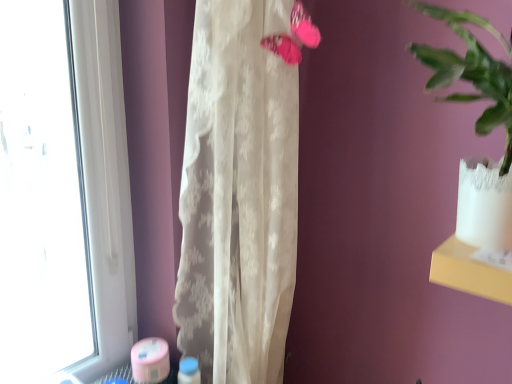
Find the location of a particular element. This screenshot has width=512, height=384. translucent white curtain at center is located at coordinates (238, 194).

Measure the distance between translucent white curtain at center and camera.

translucent white curtain at center and camera are 32.79 inches apart.

What do you see at coordinates (238, 194) in the screenshot?
I see `translucent white curtain at center` at bounding box center [238, 194].

This screenshot has height=384, width=512. Describe the element at coordinates (294, 36) in the screenshot. I see `pink fabric butterfly at upper center` at that location.

The height and width of the screenshot is (384, 512). I want to click on pink fabric butterfly at upper center, so click(x=294, y=36).

In order to click on translucent white curtain at center in this screenshot , I will do `click(238, 194)`.

Considering the relative positions of pink fabric butterfly at upper center and translucent white curtain at center in the image provided, is pink fabric butterfly at upper center to the right of translucent white curtain at center from the viewer's perspective?

Correct, you'll find pink fabric butterfly at upper center to the right of translucent white curtain at center.

Does pink fabric butterfly at upper center lie behind translucent white curtain at center?

Yes, pink fabric butterfly at upper center is further from the camera.

Is point (293, 50) less distant than point (198, 177)?

Yes, point (293, 50) is closer to viewer.

From the image's perspective, relative to translucent white curtain at center, is pink fabric butterfly at upper center above or below?

Based on their image positions, pink fabric butterfly at upper center is located above translucent white curtain at center.

From a real-world perspective, which object stands above the other?

In real-world perspective, pink fabric butterfly at upper center is above.

Which object is thinner, pink fabric butterfly at upper center or translucent white curtain at center?

With smaller width is pink fabric butterfly at upper center.

Considering the relative sizes of pink fabric butterfly at upper center and translucent white curtain at center in the image provided, is pink fabric butterfly at upper center taller than translucent white curtain at center?

No.

Based on the photo, considering the sizes of objects pink fabric butterfly at upper center and translucent white curtain at center in the image provided, who is bigger, pink fabric butterfly at upper center or translucent white curtain at center?

With larger size is translucent white curtain at center.

Is translucent white curtain at center located within pink fabric butterfly at upper center?

No, pink fabric butterfly at upper center does not contain translucent white curtain at center.

Is pink fabric butterfly at upper center in contact with translucent white curtain at center?

No, pink fabric butterfly at upper center is not beside translucent white curtain at center.

Is pink fabric butterfly at upper center oriented away from translucent white curtain at center?

Yes, pink fabric butterfly at upper center is positioned with its back facing translucent white curtain at center.

How different are the orientations of pink fabric butterfly at upper center and translucent white curtain at center in degrees?

The angular difference between pink fabric butterfly at upper center and translucent white curtain at center is 58.3 degrees.

Identify the location of flower behind the translucent white curtain at center. (294, 36).

Considering the positions of objects translucent white curtain at center and pink fabric butterfly at upper center in the image provided, who is more to the right, translucent white curtain at center or pink fabric butterfly at upper center?

pink fabric butterfly at upper center.

Which object is further away from the camera, translucent white curtain at center or pink fabric butterfly at upper center?

pink fabric butterfly at upper center is behind.

Is point (293, 80) closer or farther from the camera than point (269, 38)?

Point (293, 80) is farther from the camera than point (269, 38).

From the image's perspective, is translucent white curtain at center located above or below pink fabric butterfly at upper center?

Based on their image positions, translucent white curtain at center is located beneath pink fabric butterfly at upper center.

From a real-world perspective, who is located lower, translucent white curtain at center or pink fabric butterfly at upper center?

translucent white curtain at center is physically lower.

Can you confirm if translucent white curtain at center is wider than pink fabric butterfly at upper center?

Indeed, translucent white curtain at center has a greater width compared to pink fabric butterfly at upper center.

Can you confirm if translucent white curtain at center is taller than pink fabric butterfly at upper center?

Yes.

Which of these two, translucent white curtain at center or pink fabric butterfly at upper center, is smaller?

With smaller size is pink fabric butterfly at upper center.

Is translucent white curtain at center positioned beyond the bounds of pink fabric butterfly at upper center?

Yes.

Are translucent white curtain at center and pink fabric butterfly at upper center beside each other?

No, translucent white curtain at center is not with pink fabric butterfly at upper center.

Does translucent white curtain at center turn towards pink fabric butterfly at upper center?

Yes, translucent white curtain at center is turned towards pink fabric butterfly at upper center.

Can you tell me how much translucent white curtain at center and pink fabric butterfly at upper center differ in facing direction?

The angular difference between translucent white curtain at center and pink fabric butterfly at upper center is 58.3 degrees.

Measure the distance between translucent white curtain at center and pink fabric butterfly at upper center.

translucent white curtain at center is 13.08 inches from pink fabric butterfly at upper center.

Locate an element on the screen. The image size is (512, 384). curtain below the pink fabric butterfly at upper center (from the image's perspective) is located at coordinates (238, 194).

You are a GUI agent. You are given a task and a screenshot of the screen. Output one action in this format:
    pyautogui.click(x=<x>, y=<y>)
    Task: Click on the flower located above the translucent white curtain at center (from the image's perspective)
    
    Given the screenshot: What is the action you would take?
    pyautogui.click(x=294, y=36)

Find the location of a particular element. Image resolution: width=512 pixels, height=384 pixels. curtain in front of the pink fabric butterfly at upper center is located at coordinates (238, 194).